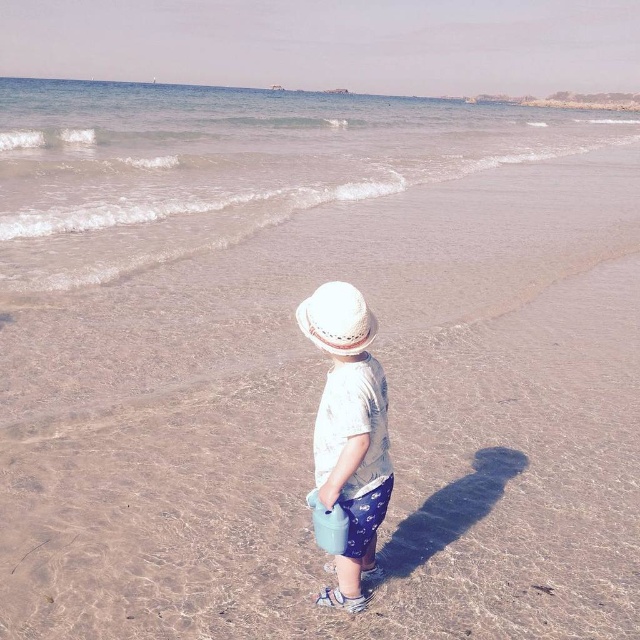
You are a photographer trying to capture the child in the scene. To ensure the clear water at upper center and the white woven hat at center are both visible in your shot, where should you position your camera relative to the child?

The clear water at upper center is above the white woven hat at center, so positioning the camera slightly above the child and aiming downward will ensure both elements are in frame.

You are a photographer positioned at the beach scene. You want to take a photo that includes both the child and the ocean. Which of the two points, point (556, 154) or point (321, 285), is closer to the camera and should be prioritized to ensure the child is in focus?

Point (556, 154) is closer to the camera than point (321, 285), so prioritizing this point will ensure the child is in focus.

From the picture: You are a photographer trying to capture the child holding the watering can in the beach scene. Which object in the image, the clear water at upper center or the white woven hat at center, will occupy more space in your photo?

The clear water at upper center is bigger than the white woven hat at center, so it will occupy more space in the photo.